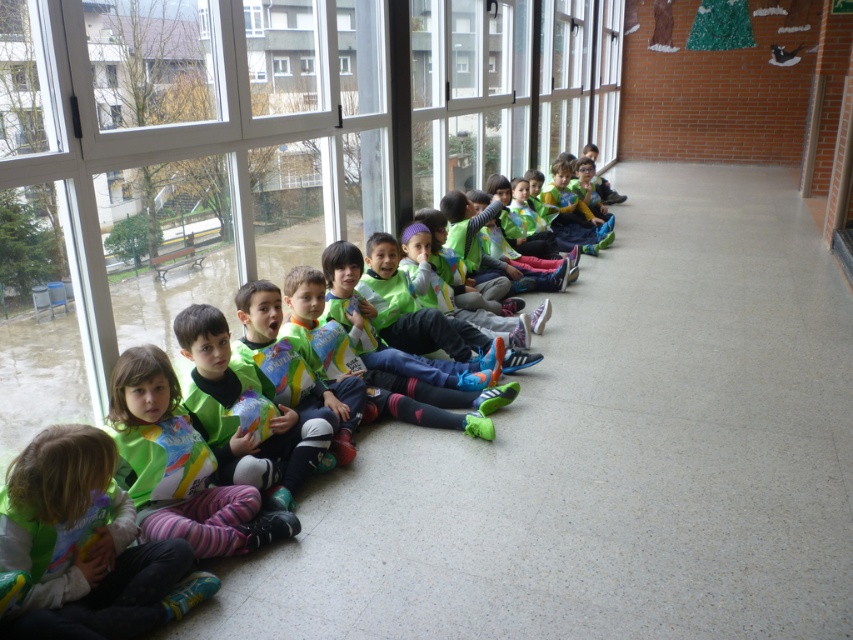
You are a photographer standing in the hallway where the children are sitting. You notice the green matte vest at center and the transparent glass window at upper center. Which object is taller when viewed from your perspective?

The green matte vest at center is taller than the transparent glass window at upper center, so the green matte vest at center appears taller when viewed from your perspective.

In the scene shown: You are a photographer setting up a shot of the children in the school hallway. You need to ensure that the matte green jacket at lower left and the transparent glass window at upper center are both visible in the frame. Which object should you adjust your camera angle to prioritize capturing first due to its size?

The matte green jacket at lower left should be prioritized because its width is greater than the transparent glass window at upper center, so it requires more space in the frame.